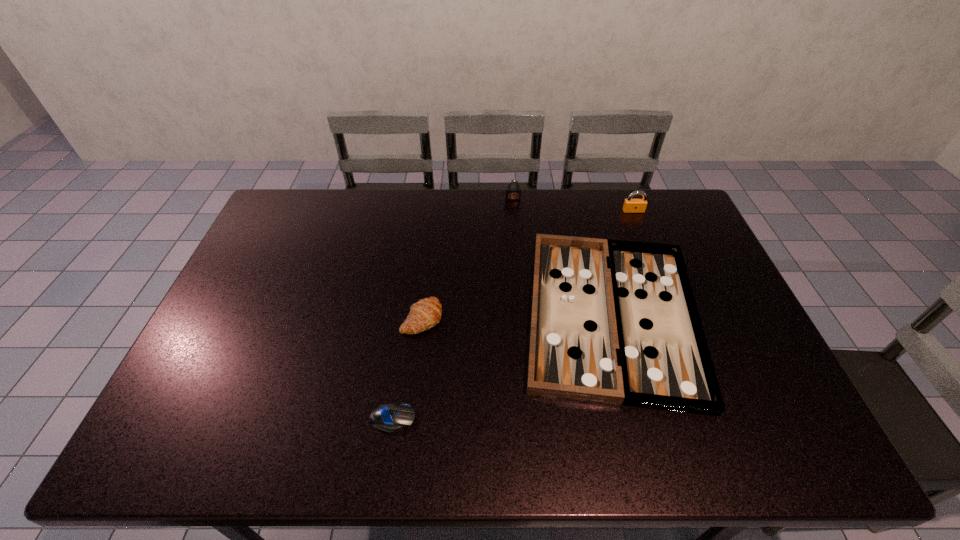
The height and width of the screenshot is (540, 960). In order to click on object that stands as the closest to the computer mouse in this screenshot , I will do `click(426, 313)`.

Find the location of a particular element. This screenshot has height=540, width=960. object that can be found as the third closest to the right padlock is located at coordinates click(426, 313).

Where is `vacant space that satisfies the following two spatial constraints: 1. to unlock the fourth nearest object from the front; 2. on the button side of the computer mouse`? This screenshot has height=540, width=960. vacant space that satisfies the following two spatial constraints: 1. to unlock the fourth nearest object from the front; 2. on the button side of the computer mouse is located at coordinates coord(715,419).

I want to click on vacant space that satisfies the following two spatial constraints: 1. on the front of the farther padlock near the keyhole; 2. on the button side of the shortest object, so click(532, 419).